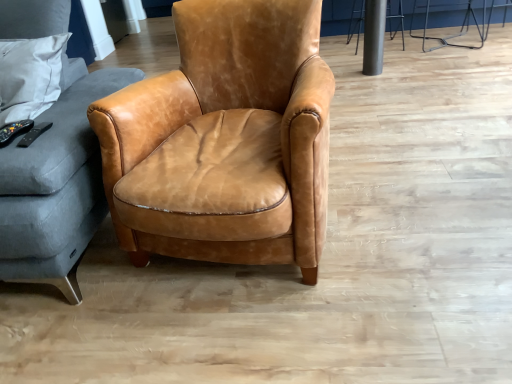
Question: Is metallic silver bar stool at upper right, the first bar stool when ordered from left to right, oriented towards matte gray fabric studio couch at left?

Choices:
 (A) yes
 (B) no

Answer: (B)

Question: Can you confirm if metallic silver bar stool at upper right, the first bar stool when ordered from left to right, is wider than matte gray fabric studio couch at left?

Choices:
 (A) yes
 (B) no

Answer: (B)

Question: Is the depth of metallic silver bar stool at upper right, the first bar stool when ordered from left to right, less than that of matte gray fabric studio couch at left?

Choices:
 (A) no
 (B) yes

Answer: (A)

Question: From the image's perspective, does metallic silver bar stool at upper right, the first bar stool when ordered from left to right, appear higher than matte gray fabric studio couch at left?

Choices:
 (A) yes
 (B) no

Answer: (A)

Question: Is metallic silver bar stool at upper right, the first bar stool when ordered from left to right, looking in the opposite direction of matte gray fabric studio couch at left?

Choices:
 (A) no
 (B) yes

Answer: (A)

Question: Is point (413, 14) closer or farther from the camera than point (219, 109)?

Choices:
 (A) farther
 (B) closer

Answer: (A)

Question: Would you say metallic silver bar stool at upper right, which is counted as the 2th bar stool, starting from the left, is to the left or to the right of cognac leather armchair at center in the picture?

Choices:
 (A) left
 (B) right

Answer: (B)

Question: From a real-world perspective, is metallic silver bar stool at upper right, which is counted as the first bar stool, starting from the right, positioned above or below cognac leather armchair at center?

Choices:
 (A) above
 (B) below

Answer: (B)

Question: Is metallic silver bar stool at upper right, which is counted as the 2th bar stool, starting from the left, bigger or smaller than cognac leather armchair at center?

Choices:
 (A) small
 (B) big

Answer: (A)

Question: In the image, is matte gray fabric studio couch at left on the left side or the right side of metallic silver bar stool at upper right, acting as the 2th bar stool starting from the right?

Choices:
 (A) left
 (B) right

Answer: (A)

Question: Considering the positions of point (36, 192) and point (353, 1), is point (36, 192) closer or farther from the camera than point (353, 1)?

Choices:
 (A) farther
 (B) closer

Answer: (B)

Question: Is matte gray fabric studio couch at left inside or outside of metallic silver bar stool at upper right, the first bar stool when ordered from left to right?

Choices:
 (A) outside
 (B) inside

Answer: (A)

Question: From the image's perspective, is matte gray fabric studio couch at left above or below metallic silver bar stool at upper right, the first bar stool when ordered from left to right?

Choices:
 (A) below
 (B) above

Answer: (A)

Question: Considering the positions of metallic silver bar stool at upper right, the first bar stool when ordered from left to right, and cognac leather armchair at center in the image, is metallic silver bar stool at upper right, the first bar stool when ordered from left to right, wider or thinner than cognac leather armchair at center?

Choices:
 (A) wide
 (B) thin

Answer: (B)

Question: Do you think metallic silver bar stool at upper right, acting as the 2th bar stool starting from the right, is within cognac leather armchair at center, or outside of it?

Choices:
 (A) inside
 (B) outside

Answer: (B)